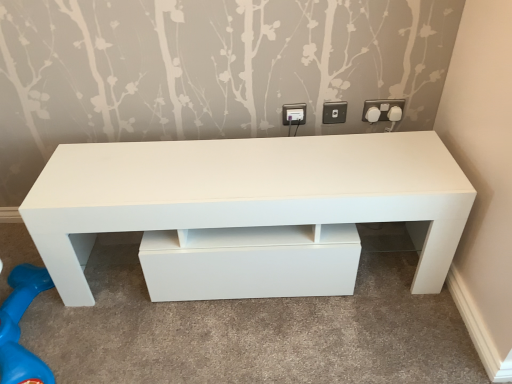
Question: From a real-world perspective, is white plastic socket at upper right, which is the 3th electric outlet in left-to-right order, on top of white plastic knob at upper right, the second knob when ordered from left to right?

Choices:
 (A) yes
 (B) no

Answer: (A)

Question: Is white plastic socket at upper right, acting as the first electric outlet starting from the right, far from white plastic knob at upper right, the second knob when ordered from left to right?

Choices:
 (A) no
 (B) yes

Answer: (A)

Question: Can you confirm if white plastic socket at upper right, acting as the first electric outlet starting from the right, is taller than white plastic knob at upper right, the first knob from the right?

Choices:
 (A) no
 (B) yes

Answer: (B)

Question: Is white plastic socket at upper right, which is the 3th electric outlet in left-to-right order, at the right side of white plastic knob at upper right, the second knob when ordered from left to right?

Choices:
 (A) yes
 (B) no

Answer: (B)

Question: Is white plastic knob at upper right, the second knob when ordered from left to right, completely or partially inside white plastic socket at upper right, which is the 3th electric outlet in left-to-right order?

Choices:
 (A) yes
 (B) no

Answer: (B)

Question: Does white plastic socket at upper right, acting as the first electric outlet starting from the right, have a smaller size compared to white plastic knob at upper right, the first knob from the right?

Choices:
 (A) no
 (B) yes

Answer: (A)

Question: Is white plastic knob at upper right, the 2th knob when ordered from right to left, taller than white plastic socket at upper right, which is the 3th electric outlet in left-to-right order?

Choices:
 (A) yes
 (B) no

Answer: (B)

Question: From a real-world perspective, is white plastic knob at upper right, the 2th knob when ordered from right to left, under white plastic socket at upper right, which is the 3th electric outlet in left-to-right order?

Choices:
 (A) yes
 (B) no

Answer: (A)

Question: Would you say white plastic socket at upper right, which is the 3th electric outlet in left-to-right order, is part of white plastic knob at upper right, which appears as the first knob when viewed from the left,'s contents?

Choices:
 (A) yes
 (B) no

Answer: (B)

Question: Could you tell me if white plastic knob at upper right, which appears as the first knob when viewed from the left, is facing white plastic socket at upper right, acting as the first electric outlet starting from the right?

Choices:
 (A) yes
 (B) no

Answer: (B)

Question: Is white plastic knob at upper right, the 2th knob when ordered from right to left, positioned beyond the bounds of white plastic socket at upper right, acting as the first electric outlet starting from the right?

Choices:
 (A) no
 (B) yes

Answer: (B)

Question: From the image's perspective, is white plastic knob at upper right, the 2th knob when ordered from right to left, over white plastic socket at upper right, acting as the first electric outlet starting from the right?

Choices:
 (A) no
 (B) yes

Answer: (A)

Question: Is white plastic knob at upper right, the 2th knob when ordered from right to left, completely or partially inside white plastic knob at upper right, the second knob when ordered from left to right?

Choices:
 (A) yes
 (B) no

Answer: (B)